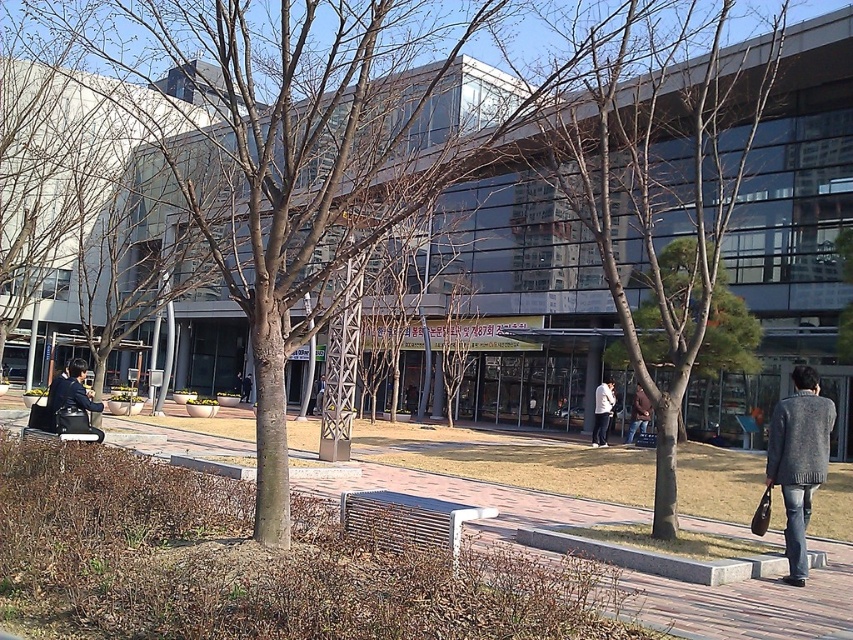
Question: Estimate the real-world distances between objects in this image. Which object is farther from the metallic silver bench at center?

Choices:
 (A) white matte jacket at center
 (B) bare wood tree at center

Answer: (A)

Question: Which point is closer to the camera?

Choices:
 (A) bare wood tree at center
 (B) brick pavement at center
 (C) gray knitted sweater at right

Answer: (B)

Question: Which of the following is the farthest from the observer?

Choices:
 (A) (x=467, y=516)
 (B) (x=697, y=84)

Answer: (B)

Question: Can you confirm if brick pavement at center is bigger than metallic silver bench at center?

Choices:
 (A) no
 (B) yes

Answer: (B)

Question: Is bare wood tree at center in front of brick pavement at center?

Choices:
 (A) yes
 (B) no

Answer: (B)

Question: Is gray knitted sweater at right thinner than black leather bench at lower left?

Choices:
 (A) no
 (B) yes

Answer: (B)